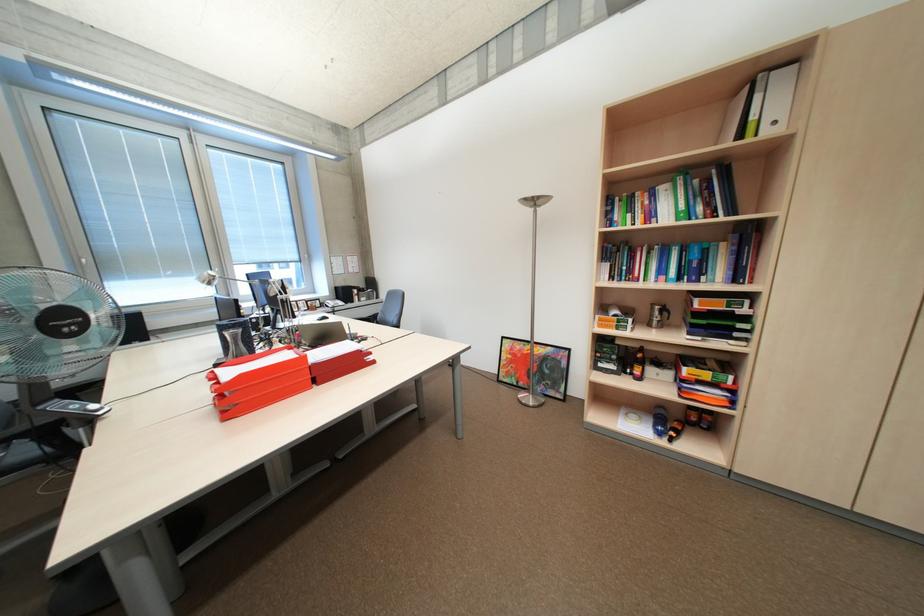
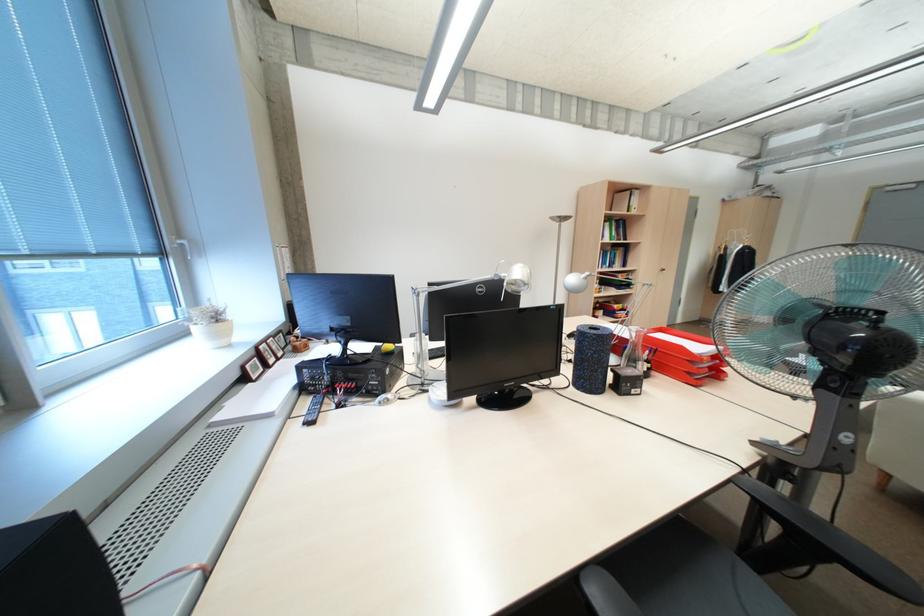
Locate, in the second image, the point that corresponds to point 661,215 in the first image.

(612, 236)